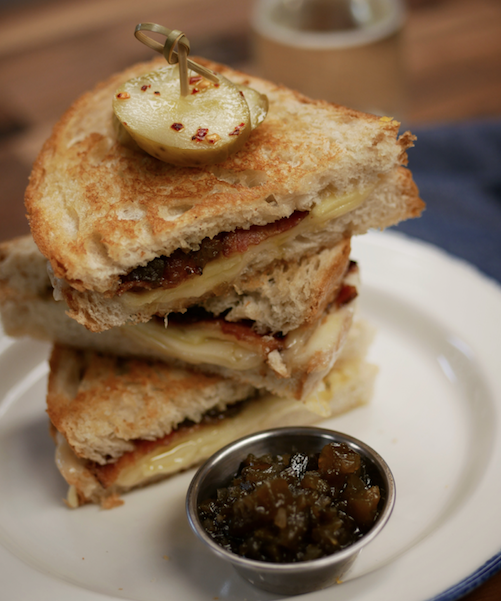
Image resolution: width=501 pixels, height=601 pixels. What are the coordinates of `cup` in the screenshot? It's located at (247, 564).